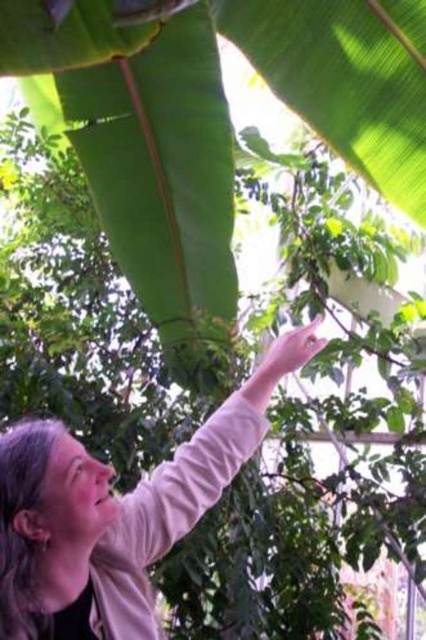
Question: Does light pink fabric at upper right have a smaller size compared to pink smooth skin at upper center?

Choices:
 (A) yes
 (B) no

Answer: (B)

Question: Which point is farther from the camera taking this photo?

Choices:
 (A) (285, 365)
 (B) (198, 444)

Answer: (A)

Question: Is light pink fabric at upper right to the right of pink smooth skin at upper center from the viewer's perspective?

Choices:
 (A) no
 (B) yes

Answer: (A)

Question: Can you confirm if light pink fabric at upper right is smaller than pink smooth skin at upper center?

Choices:
 (A) yes
 (B) no

Answer: (B)

Question: Among these points, which one is farthest from the camera?

Choices:
 (A) (304, 337)
 (B) (147, 634)

Answer: (A)